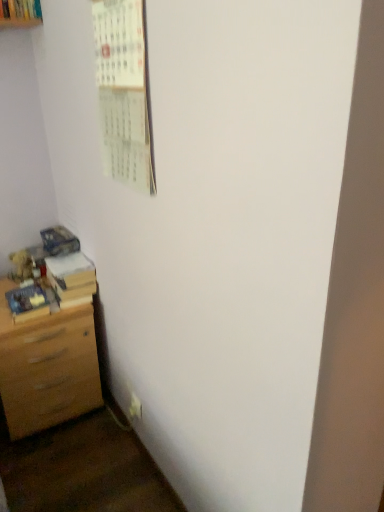
Locate an element on the screen. light brown wood chest of drawers at lower left is located at coordinates (47, 368).

Describe the element at coordinates (47, 368) in the screenshot. This screenshot has height=512, width=384. I see `light brown wood chest of drawers at lower left` at that location.

Locate an element on the screen. matte blue book at lower left, which appears as the first book when viewed from the front is located at coordinates (27, 303).

Image resolution: width=384 pixels, height=512 pixels. What do you see at coordinates (135, 407) in the screenshot?
I see `white plastic electric outlet at lower left` at bounding box center [135, 407].

Describe the element at coordinates (71, 278) in the screenshot. I see `wooden book at lower left, which is counted as the 1th book, starting from the back` at that location.

Where is `light brown wood chest of drawers at lower left`? This screenshot has width=384, height=512. light brown wood chest of drawers at lower left is located at coordinates (47, 368).

From the image's perspective, is white paper calendar at upper left positioned above or below white plastic electric outlet at lower left?

white paper calendar at upper left is situated higher than white plastic electric outlet at lower left in the image.

What's the angular difference between white paper calendar at upper left and white plastic electric outlet at lower left's facing directions?

There is a 0.00889-degree angle between the facing directions of white paper calendar at upper left and white plastic electric outlet at lower left.

Is point (136, 106) farther from camera compared to point (131, 398)?

No, (136, 106) is closer to viewer.

Is white paper calendar at upper left positioned with its back to white plastic electric outlet at lower left?

white paper calendar at upper left is not turned away from white plastic electric outlet at lower left.

Is matte blue book at lower left, which appears as the first book when viewed from the front, at the right side of wooden book at lower left, which is counted as the 1th book, starting from the back?

Incorrect, matte blue book at lower left, which appears as the first book when viewed from the front, is not on the right side of wooden book at lower left, which is counted as the 1th book, starting from the back.

From the image's perspective, does matte blue book at lower left, positioned as the second book in back-to-front order, appear higher than wooden book at lower left, which is counted as the 1th book, starting from the back?

No.

Who is smaller, matte blue book at lower left, which appears as the first book when viewed from the front, or wooden book at lower left, which is counted as the 1th book, starting from the back?

Smaller between the two is matte blue book at lower left, which appears as the first book when viewed from the front.

Between matte blue book at lower left, positioned as the second book in back-to-front order, and wooden book at lower left, the second book viewed from the front, which one is positioned in front?

matte blue book at lower left, positioned as the second book in back-to-front order, is in front.

Are wooden book at lower left, which is counted as the 1th book, starting from the back, and light brown wood chest of drawers at lower left located far from each other?

No, there isn't a large distance between wooden book at lower left, which is counted as the 1th book, starting from the back, and light brown wood chest of drawers at lower left.

Is wooden book at lower left, which is counted as the 1th book, starting from the back, at the right side of light brown wood chest of drawers at lower left?

Indeed, wooden book at lower left, which is counted as the 1th book, starting from the back, is positioned on the right side of light brown wood chest of drawers at lower left.

Which is correct: wooden book at lower left, the second book viewed from the front, is inside light brown wood chest of drawers at lower left, or outside of it?

wooden book at lower left, the second book viewed from the front, exists outside the volume of light brown wood chest of drawers at lower left.

Between wooden book at lower left, the second book viewed from the front, and light brown wood chest of drawers at lower left, which one is positioned behind?

wooden book at lower left, the second book viewed from the front, is further away from the camera.

How many degrees apart are the facing directions of light brown wood chest of drawers at lower left and white paper calendar at upper left?

The angle between the facing direction of light brown wood chest of drawers at lower left and the facing direction of white paper calendar at upper left is 89.3 degrees.

Is light brown wood chest of drawers at lower left oriented towards white paper calendar at upper left?

No, light brown wood chest of drawers at lower left is not turned towards white paper calendar at upper left.

Is light brown wood chest of drawers at lower left completely or partially outside of white paper calendar at upper left?

light brown wood chest of drawers at lower left is positioned outside white paper calendar at upper left.

Considering the relative sizes of light brown wood chest of drawers at lower left and white paper calendar at upper left in the image provided, is light brown wood chest of drawers at lower left smaller than white paper calendar at upper left?

No, light brown wood chest of drawers at lower left is not smaller than white paper calendar at upper left.

Is wooden book at lower left, the second book viewed from the front, completely or partially inside white paper calendar at upper left?

No, wooden book at lower left, the second book viewed from the front, is not surrounded by white paper calendar at upper left.

Consider the image. From the image's perspective, is white paper calendar at upper left positioned above or below wooden book at lower left, which is counted as the 1th book, starting from the back?

Based on their image positions, white paper calendar at upper left is located above wooden book at lower left, which is counted as the 1th book, starting from the back.

Is white paper calendar at upper left shorter than wooden book at lower left, the second book viewed from the front?

No.

Could you measure the distance between wooden book at lower left, which is counted as the 1th book, starting from the back, and white plastic electric outlet at lower left?

21.31 inches.

From the image's perspective, which one is positioned lower, wooden book at lower left, the second book viewed from the front, or white plastic electric outlet at lower left?

white plastic electric outlet at lower left, from the image's perspective.

Who is taller, wooden book at lower left, the second book viewed from the front, or white plastic electric outlet at lower left?

white plastic electric outlet at lower left.

Is wooden book at lower left, the second book viewed from the front, with white plastic electric outlet at lower left?

No, wooden book at lower left, the second book viewed from the front, is not making contact with white plastic electric outlet at lower left.

Considering the sizes of white plastic electric outlet at lower left and matte blue book at lower left, which appears as the first book when viewed from the front, in the image, is white plastic electric outlet at lower left wider or thinner than matte blue book at lower left, which appears as the first book when viewed from the front,?

white plastic electric outlet at lower left is thinner than matte blue book at lower left, which appears as the first book when viewed from the front.

Which of these two, white plastic electric outlet at lower left or matte blue book at lower left, which appears as the first book when viewed from the front, is bigger?

matte blue book at lower left, which appears as the first book when viewed from the front, is bigger.

Is white plastic electric outlet at lower left further to camera compared to matte blue book at lower left, positioned as the second book in back-to-front order?

Yes, the depth of white plastic electric outlet at lower left is greater than that of matte blue book at lower left, positioned as the second book in back-to-front order.

I want to click on electric outlet that appears below the white paper calendar at upper left (from the image's perspective), so click(135, 407).

This screenshot has height=512, width=384. I want to click on book that appears in front of the wooden book at lower left, the second book viewed from the front, so click(x=27, y=303).

In the scene shown: Considering their positions, is white paper calendar at upper left positioned closer to matte blue book at lower left, positioned as the second book in back-to-front order, than white plastic electric outlet at lower left?

white plastic electric outlet at lower left.

Based on their spatial positions, is matte blue book at lower left, which appears as the first book when viewed from the front, or white plastic electric outlet at lower left closer to light brown wood chest of drawers at lower left?

The object closer to light brown wood chest of drawers at lower left is matte blue book at lower left, which appears as the first book when viewed from the front.

When comparing their distances from white plastic electric outlet at lower left, does matte blue book at lower left, positioned as the second book in back-to-front order, or wooden book at lower left, the second book viewed from the front, seem closer?

The object closer to white plastic electric outlet at lower left is wooden book at lower left, the second book viewed from the front.

From the image, which object appears to be nearer to white paper calendar at upper left, matte blue book at lower left, positioned as the second book in back-to-front order, or light brown wood chest of drawers at lower left?

The object closer to white paper calendar at upper left is matte blue book at lower left, positioned as the second book in back-to-front order.

Considering their positions, is white paper calendar at upper left positioned closer to light brown wood chest of drawers at lower left than white plastic electric outlet at lower left?

Among the two, white plastic electric outlet at lower left is located nearer to light brown wood chest of drawers at lower left.

From the image, which object appears to be nearer to white paper calendar at upper left, white plastic electric outlet at lower left or matte blue book at lower left, positioned as the second book in back-to-front order?

The object closer to white paper calendar at upper left is matte blue book at lower left, positioned as the second book in back-to-front order.

Which object lies further to the anchor point light brown wood chest of drawers at lower left, matte blue book at lower left, which appears as the first book when viewed from the front, or wooden book at lower left, the second book viewed from the front?

wooden book at lower left, the second book viewed from the front.

From the image, which object appears to be farther from light brown wood chest of drawers at lower left, white plastic electric outlet at lower left or wooden book at lower left, the second book viewed from the front?

white plastic electric outlet at lower left.

I want to click on book located between white paper calendar at upper left and wooden book at lower left, which is counted as the 1th book, starting from the back, in the depth direction, so click(27, 303).

Image resolution: width=384 pixels, height=512 pixels. Find the location of `book that lies between wooden book at lower left, which is counted as the 1th book, starting from the back, and light brown wood chest of drawers at lower left from top to bottom`. book that lies between wooden book at lower left, which is counted as the 1th book, starting from the back, and light brown wood chest of drawers at lower left from top to bottom is located at coordinates (27, 303).

I want to click on the chest of drawers that lies between wooden book at lower left, the second book viewed from the front, and white plastic electric outlet at lower left from top to bottom, so point(47,368).

You are a GUI agent. You are given a task and a screenshot of the screen. Output one action in this format:
    pyautogui.click(x=<x>, y=<y>)
    Task: Click on the chest of drawers between white paper calendar at upper left and white plastic electric outlet at lower left vertically
    
    Given the screenshot: What is the action you would take?
    pyautogui.click(x=47, y=368)